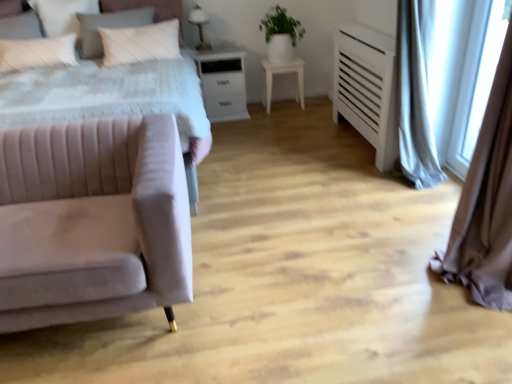
Locate an element on the screen. This screenshot has height=384, width=512. white soft pillow at upper left, marked as the 2th pillow in a right-to-left arrangement is located at coordinates (x=62, y=14).

Measure the distance between point [301,107] and camera.

The depth of point [301,107] is 4.25 meters.

Measure the distance between white glossy nightstand at center and camera.

white glossy nightstand at center and camera are 3.74 meters apart from each other.

Image resolution: width=512 pixels, height=384 pixels. I want to click on light gray fabric curtain at right, so click(486, 202).

Is white glossy table lamp at upper center positioned with its back to velvet pink bed at left?

No, white glossy table lamp at upper center's orientation is not away from velvet pink bed at left.

I want to click on table lamp that is on the right side of velvet pink bed at left, so click(199, 25).

Is white glossy table lamp at upper center positioned in front of velvet pink bed at left?

No, white glossy table lamp at upper center is behind velvet pink bed at left.

Is white matte table at center not close to white glossy nightstand at center?

That's not correct — white matte table at center is a little close to white glossy nightstand at center.

Does white matte table at center turn towards white glossy nightstand at center?

No, white matte table at center is not aimed at white glossy nightstand at center.

Which of these two, white matte table at center or white glossy nightstand at center, is wider?

white glossy nightstand at center.

Locate an element on the screen. nightstand above the white matte table at center (from a real-world perspective) is located at coordinates (223, 82).

Choose the correct answer: Is white glossy nightstand at center inside velvet pink couch at left or outside it?

white glossy nightstand at center is spatially situated outside velvet pink couch at left.

Between white glossy nightstand at center and velvet pink couch at left, which one has larger width?

velvet pink couch at left.

Which of these two, white glossy nightstand at center or velvet pink couch at left, is bigger?

velvet pink couch at left.

Is velvet pink couch at left at the back of white glossy nightstand at center?

No, white glossy nightstand at center is not facing away from velvet pink couch at left.

Can white glossy nightstand at center be found inside white glossy table lamp at upper center?

No, white glossy nightstand at center is not a part of white glossy table lamp at upper center.

Locate an element on the screen. The image size is (512, 384). nightstand that is under the white glossy table lamp at upper center (from a real-world perspective) is located at coordinates (223, 82).

Considering their positions, is white glossy table lamp at upper center located in front of or behind white glossy nightstand at center?

Clearly, white glossy table lamp at upper center is behind white glossy nightstand at center.

From a real-world perspective, between white glossy table lamp at upper center and white glossy nightstand at center, who is vertically lower?

In real-world perspective, white glossy nightstand at center is lower.

Can you confirm if green matte plant at upper center is thinner than light gray fabric curtain at right?

Incorrect, the width of green matte plant at upper center is not less than that of light gray fabric curtain at right.

From a real-world perspective, is green matte plant at upper center above or below light gray fabric curtain at right?

Clearly, from a real-world perspective, green matte plant at upper center is above light gray fabric curtain at right.

Can you confirm if green matte plant at upper center is shorter than light gray fabric curtain at right?

Yes, green matte plant at upper center is shorter than light gray fabric curtain at right.

Is green matte plant at upper center not within light gray fabric curtain at right?

Absolutely, green matte plant at upper center is external to light gray fabric curtain at right.

Which is behind, point (60, 16) or point (482, 92)?

The point (60, 16) is farther.

How many degrees apart are the facing directions of white soft pillow at upper left, the 1th pillow in the left-to-right sequence, and transparent glass window screen at right?

The facing directions of white soft pillow at upper left, the 1th pillow in the left-to-right sequence, and transparent glass window screen at right are 89.9 degrees apart.

Which of these two, white soft pillow at upper left, marked as the 2th pillow in a right-to-left arrangement, or transparent glass window screen at right, is smaller?

Smaller between the two is transparent glass window screen at right.

From a real-world perspective, who is located higher, white soft pillow at upper left, marked as the 2th pillow in a right-to-left arrangement, or transparent glass window screen at right?

white soft pillow at upper left, marked as the 2th pillow in a right-to-left arrangement.

Is green matte plant at upper center not close to white quilted pillow at upper left, which is counted as the first pillow, starting from the right?

Yes, green matte plant at upper center and white quilted pillow at upper left, which is counted as the first pillow, starting from the right, are quite far apart.

Does green matte plant at upper center appear on the left side of white quilted pillow at upper left, acting as the second pillow starting from the left?

No, green matte plant at upper center is not to the left of white quilted pillow at upper left, acting as the second pillow starting from the left.

Is green matte plant at upper center facing towards white quilted pillow at upper left, which is counted as the first pillow, starting from the right?

No, green matte plant at upper center is not aimed at white quilted pillow at upper left, which is counted as the first pillow, starting from the right.

Identify the location of table lamp that is above the velvet pink bed at left (from the image's perspective). The width and height of the screenshot is (512, 384). (199, 25).

Identify the location of table that is on the right side of white glossy nightstand at center. (283, 73).

Looking at the image, which one is located closer to transparent glass window screen at right, white soft pillow at upper left, marked as the 2th pillow in a right-to-left arrangement, or green matte plant at upper center?

green matte plant at upper center.

Based on their spatial positions, is velvet pink bed at left or white soft pillow at upper left, the 1th pillow in the left-to-right sequence, closer to white quilted pillow at upper left, acting as the second pillow starting from the left?

The object closer to white quilted pillow at upper left, acting as the second pillow starting from the left, is white soft pillow at upper left, the 1th pillow in the left-to-right sequence.

When comparing their distances from white soft pillow at upper left, marked as the 2th pillow in a right-to-left arrangement, does white quilted pillow at upper left, which is counted as the first pillow, starting from the right, or transparent glass window screen at right seem further?

Among the two, transparent glass window screen at right is located further to white soft pillow at upper left, marked as the 2th pillow in a right-to-left arrangement.

In the scene shown: Which object lies nearer to the anchor point transparent glass window screen at right, light gray fabric curtain at right or velvet pink couch at left?

The object closer to transparent glass window screen at right is light gray fabric curtain at right.

When comparing their distances from transparent glass window screen at right, does white soft pillow at upper left, the 1th pillow in the left-to-right sequence, or white quilted pillow at upper left, acting as the second pillow starting from the left, seem further?

white soft pillow at upper left, the 1th pillow in the left-to-right sequence, is positioned further to the anchor transparent glass window screen at right.

From the image, which object appears to be nearer to velvet pink bed at left, white quilted pillow at upper left, acting as the second pillow starting from the left, or white soft pillow at upper left, marked as the 2th pillow in a right-to-left arrangement?

white quilted pillow at upper left, acting as the second pillow starting from the left, is positioned closer to the anchor velvet pink bed at left.

When comparing their distances from white matte table at center, does green matte plant at upper center or light gray fabric curtain at right seem further?

The object further to white matte table at center is light gray fabric curtain at right.

Estimate the real-world distances between objects in this image. Which object is further from velvet pink bed at left, white glossy nightstand at center or transparent glass window screen at right?

The object further to velvet pink bed at left is transparent glass window screen at right.

Locate an element on the screen. This screenshot has width=512, height=384. window screen located between light gray fabric curtain at right and white glossy table lamp at upper center in the depth direction is located at coordinates (477, 81).

Where is `plant between white soft pillow at upper left, the 1th pillow in the left-to-right sequence, and light gray fabric curtain at right from left to right`? The width and height of the screenshot is (512, 384). plant between white soft pillow at upper left, the 1th pillow in the left-to-right sequence, and light gray fabric curtain at right from left to right is located at coordinates (281, 25).

What are the coordinates of `nightstand positioned between velvet pink bed at left and white matte table at center from near to far` in the screenshot? It's located at (223, 82).

Identify the location of nightstand located between white quilted pillow at upper left, which is counted as the first pillow, starting from the right, and white matte table at center in the left-right direction. (223, 82).